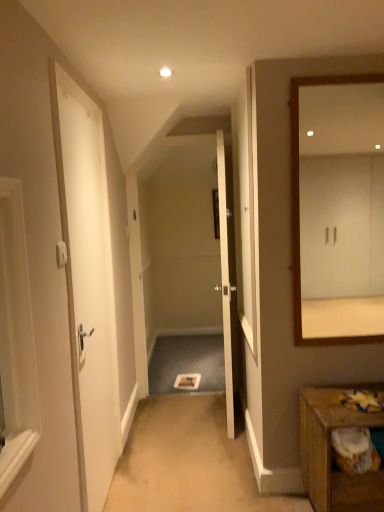
Question: Can you confirm if white wooden mirror at right is wider than white matte door at left, which is the 2th door in back-to-front order?

Choices:
 (A) no
 (B) yes

Answer: (B)

Question: Is white wooden mirror at right bigger than white matte door at left, which is the 2th door in back-to-front order?

Choices:
 (A) no
 (B) yes

Answer: (A)

Question: Is there a large distance between white wooden mirror at right and white matte door at left, arranged as the 2th door when viewed from the right?

Choices:
 (A) yes
 (B) no

Answer: (A)

Question: Does white wooden mirror at right have a lesser height compared to white matte door at left, which is the 2th door in back-to-front order?

Choices:
 (A) yes
 (B) no

Answer: (A)

Question: From the image's perspective, is white wooden mirror at right on top of white matte door at left, which is the 2th door in back-to-front order?

Choices:
 (A) no
 (B) yes

Answer: (B)

Question: From their relative heights in the image, would you say white wooden mirror at right is taller or shorter than wooden table at lower right?

Choices:
 (A) tall
 (B) short

Answer: (A)

Question: Is point (362, 295) closer or farther from the camera than point (326, 477)?

Choices:
 (A) farther
 (B) closer

Answer: (A)

Question: Based on their sizes in the image, would you say white wooden mirror at right is bigger or smaller than wooden table at lower right?

Choices:
 (A) small
 (B) big

Answer: (A)

Question: From the image's perspective, is white wooden mirror at right located above or below wooden table at lower right?

Choices:
 (A) below
 (B) above

Answer: (B)

Question: From the image's perspective, is white glossy door at center, acting as the 2th door starting from the front, positioned above or below white wooden mirror at right?

Choices:
 (A) above
 (B) below

Answer: (B)

Question: Considering the positions of white glossy door at center, the first door viewed from the back, and white wooden mirror at right in the image, is white glossy door at center, the first door viewed from the back, bigger or smaller than white wooden mirror at right?

Choices:
 (A) big
 (B) small

Answer: (A)

Question: In terms of width, does white glossy door at center, acting as the 2th door starting from the front, look wider or thinner when compared to white wooden mirror at right?

Choices:
 (A) thin
 (B) wide

Answer: (B)

Question: Does point (233, 229) appear closer or farther from the camera than point (327, 116)?

Choices:
 (A) closer
 (B) farther

Answer: (A)

Question: Is wooden table at lower right to the left or to the right of white matte door at left, placed as the 1th door when sorted from front to back, in the image?

Choices:
 (A) right
 (B) left

Answer: (A)

Question: From a real-world perspective, is wooden table at lower right physically located above or below white matte door at left, placed as the 1th door when sorted from front to back?

Choices:
 (A) above
 (B) below

Answer: (B)